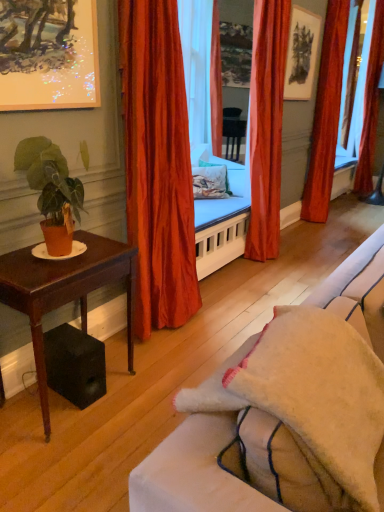
The image size is (384, 512). Identify the location of empty space that is ontop of mahogany wood side table at left (from a real-world perspective). (49, 259).